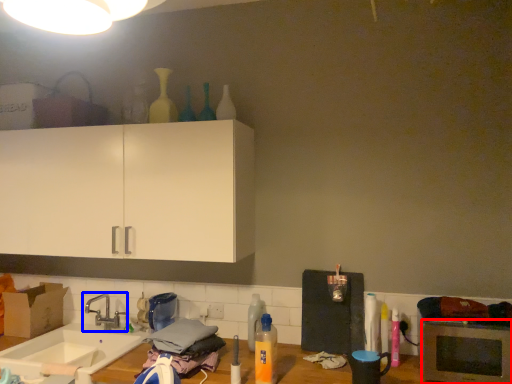
Question: Which of the following is the farthest to the observer, microwave oven (highlighted by a red box) or tap (highlighted by a blue box)?

Choices:
 (A) microwave oven
 (B) tap

Answer: (B)